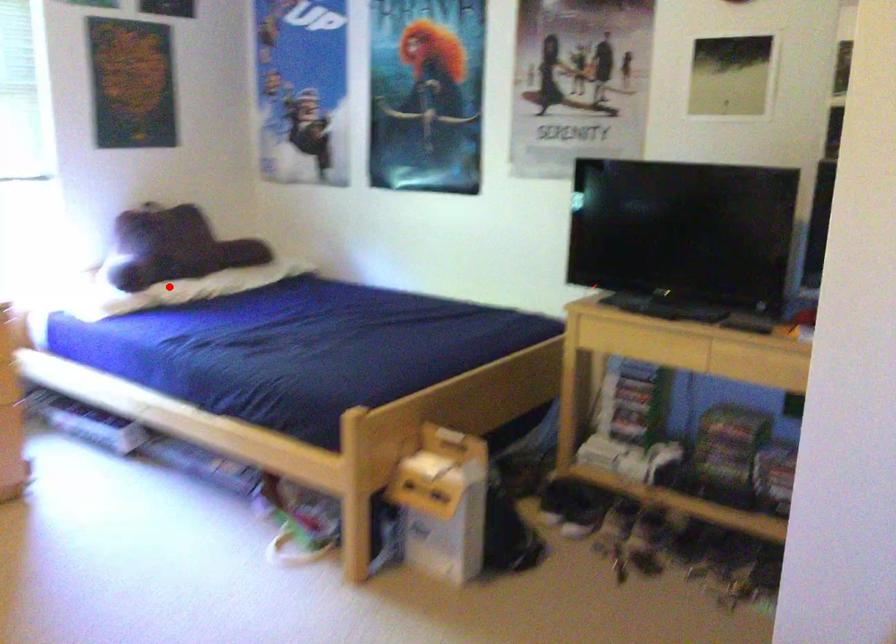
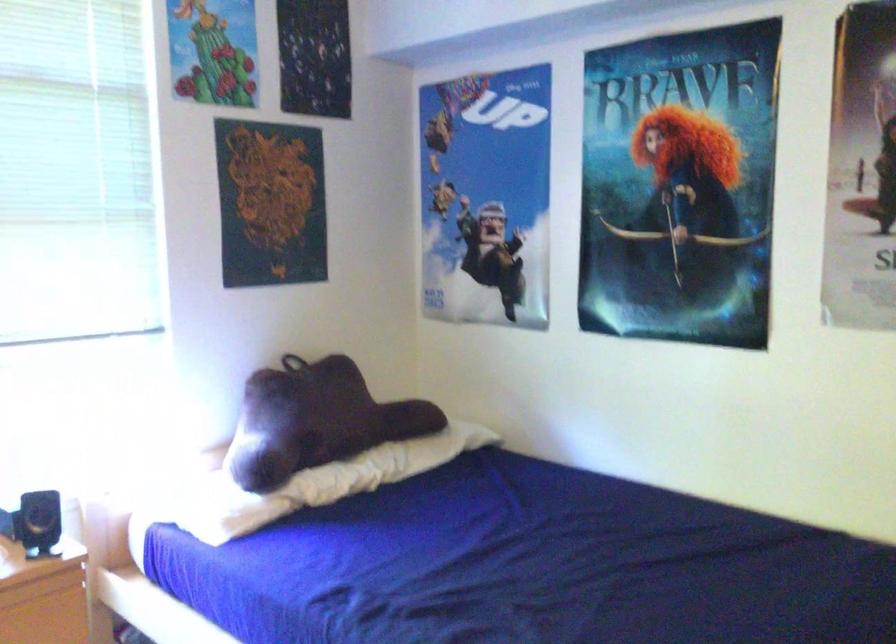
Question: I am providing you with two images of the same scene from different viewpoints. In image1, a red point is highlighted. Considering the same 3D point in image2, which of the following is correct?

Choices:
 (A) It is closer
 (B) It is farther

Answer: (A)